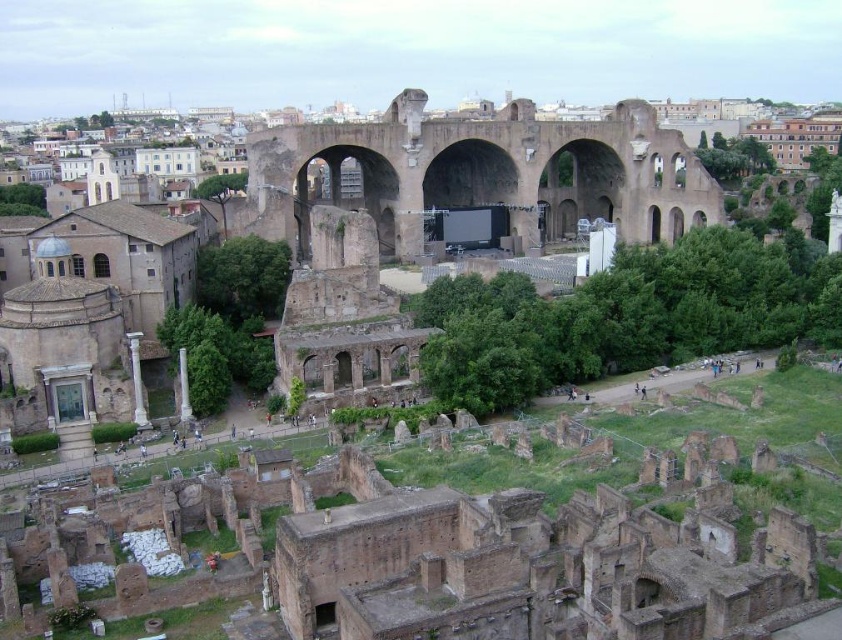
You are a tour guide explaining the layout of the Roman Forum. You point to the brown stone ruins at center and the white marble pillar at lower left. Which one is positioned higher in the image?

The brown stone ruins at center is above the white marble pillar at lower left, so it is positioned higher in the image.

You are a tour guide explaining the Roman Forum to visitors. You point out the brown stone ruins at center and the white marble column at lower left. Which of these two objects is larger in size?

The brown stone ruins at center is bigger than the white marble column at lower left according to the description.

Based on the coordinates provided, where exactly is the brown stone ruins at center located in the image?

The brown stone ruins at center are located at the 2D coordinates point [486,173].